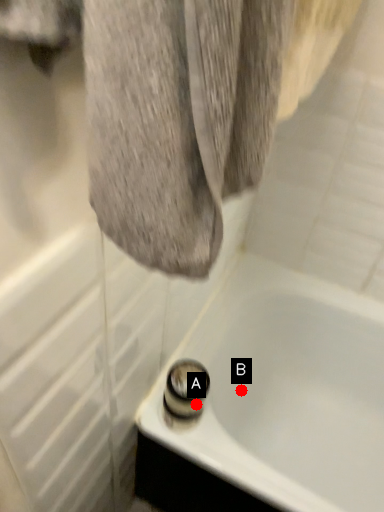
Question: Two points are circled on the image, labeled by A and B beside each circle. Which point appears closest to the camera in this image?

Choices:
 (A) A is closer
 (B) B is closer

Answer: (A)